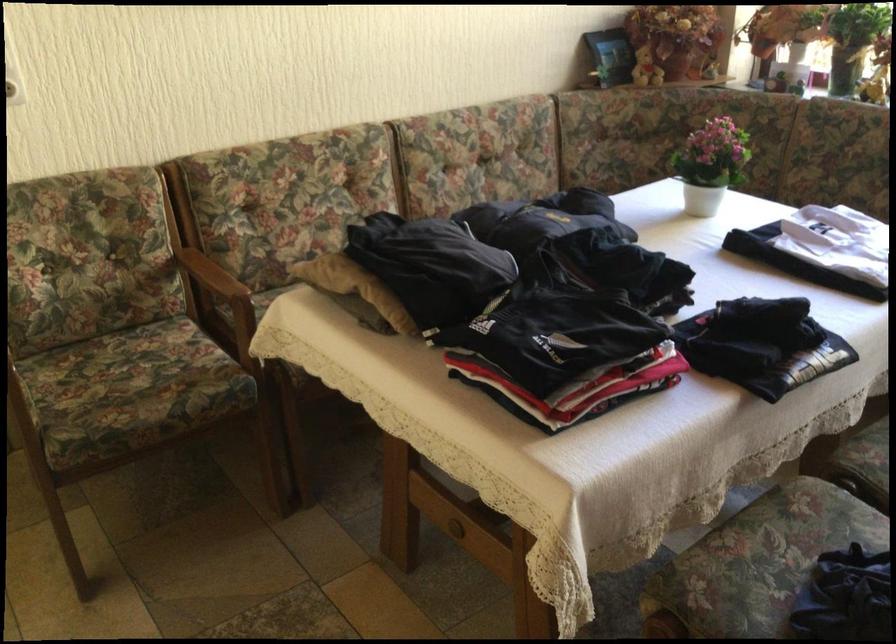
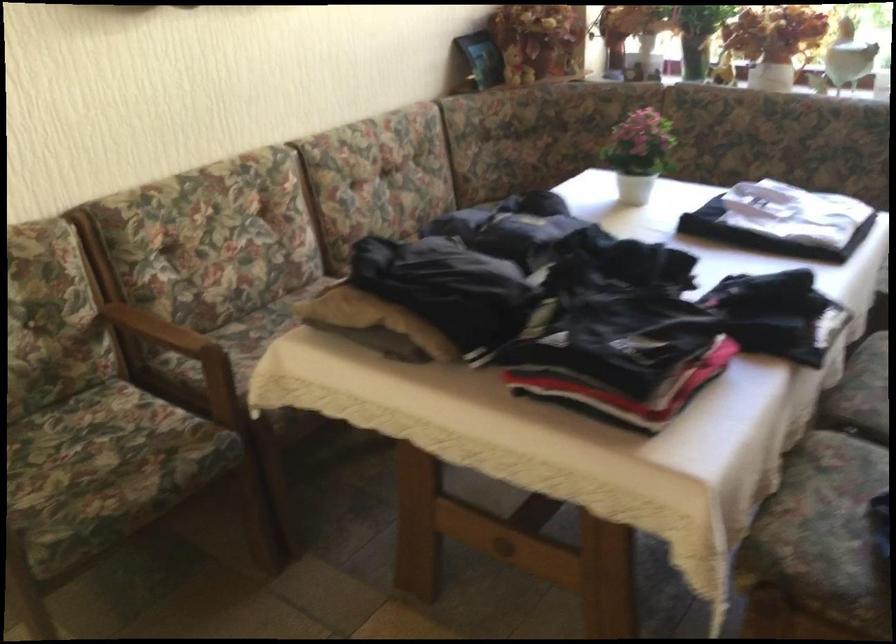
Question: In a continuous first-person perspective shot, in which direction is the camera moving?

Choices:
 (A) Left
 (B) Right
 (C) Forward
 (D) Backward

Answer: (A)